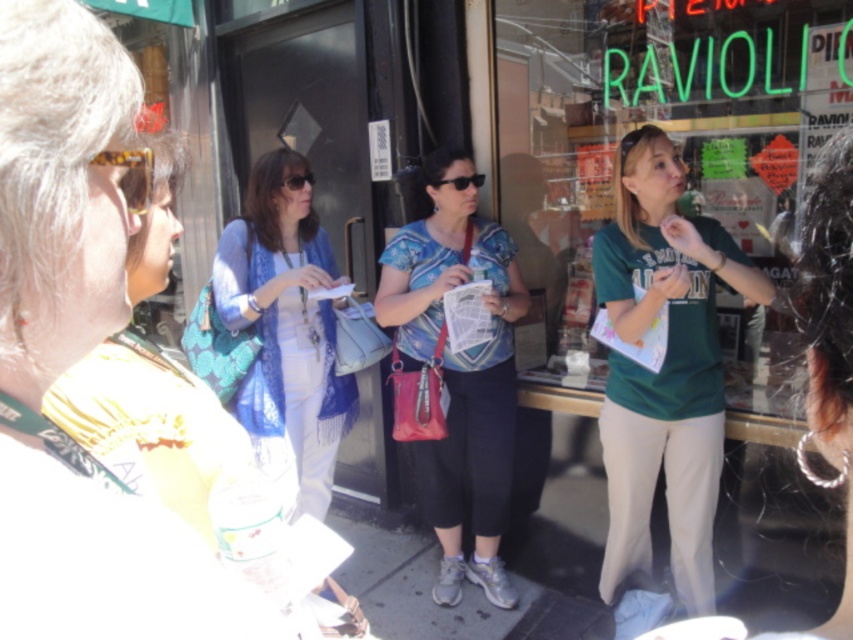
Question: Is matte blue blouse at center thinner than matte black sunglasses at center?

Choices:
 (A) yes
 (B) no

Answer: (B)

Question: Can you confirm if blue lace shirt at upper center is smaller than matte blue blouse at center?

Choices:
 (A) yes
 (B) no

Answer: (A)

Question: Among these points, which one is farthest from the camera?

Choices:
 (A) (451, 179)
 (B) (325, 285)
 (C) (286, 177)

Answer: (C)

Question: Which point is closer to the camera?

Choices:
 (A) (608, 250)
 (B) (442, 604)

Answer: (A)

Question: Is matte blue blouse at center thinner than black plastic sunglasses at center?

Choices:
 (A) yes
 (B) no

Answer: (B)

Question: Which object is closer to the camera taking this photo?

Choices:
 (A) green cotton shirt at center
 (B) matte black sunglasses at center
 (C) translucent amber goggles at left

Answer: (C)